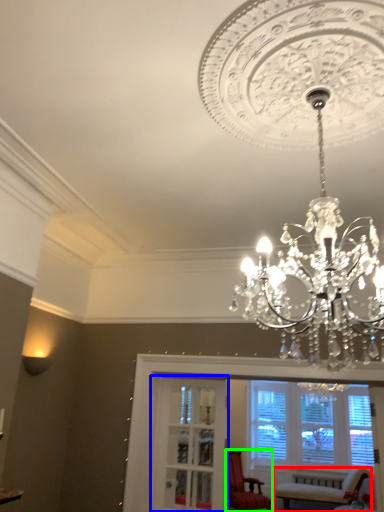
Question: Which is nearer to the chair (highlighted by a red box)? glass door (highlighted by a blue box) or chair (highlighted by a green box).

Choices:
 (A) glass door
 (B) chair

Answer: (B)